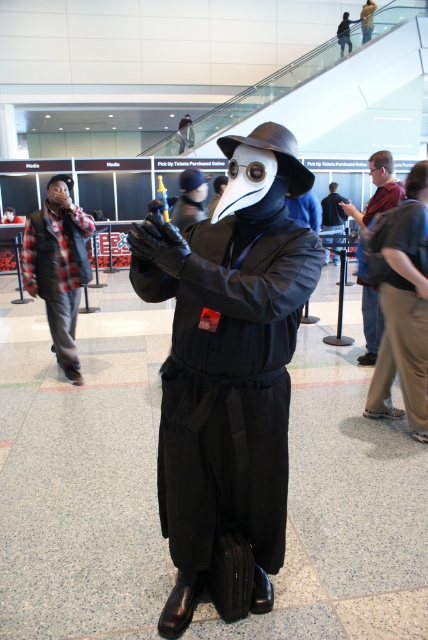
Question: Does plaid fabric shirt at left lie in front of matte black backpack at center?

Choices:
 (A) no
 (B) yes

Answer: (A)

Question: Can you confirm if matte black costume at center is thinner than matte black mask at center?

Choices:
 (A) no
 (B) yes

Answer: (B)

Question: Observing the image, what is the correct spatial positioning of plaid fabric shirt at left in reference to matte black backpack at center?

Choices:
 (A) left
 (B) right

Answer: (A)

Question: Which object is farther from the camera taking this photo?

Choices:
 (A) black matte mask at right
 (B) matte black mask at center
 (C) plaid fabric shirt at left

Answer: (B)

Question: Considering the real-world distances, which object is farthest from the plaid fabric shirt at left?

Choices:
 (A) matte black costume at center
 (B) black matte mask at right
 (C) matte black backpack at center

Answer: (A)

Question: Which of the following is the farthest from the observer?

Choices:
 (A) (199, 387)
 (B) (338, 257)
 (C) (64, 182)

Answer: (B)